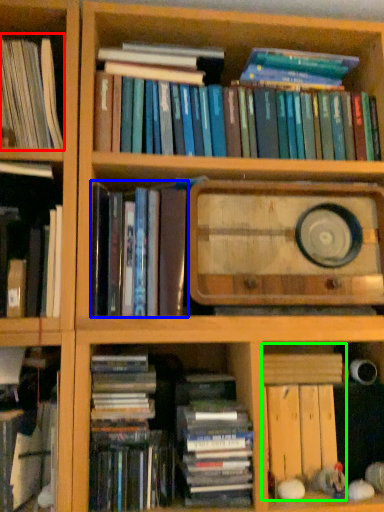
Question: Which object is the farthest from book (highlighted by a red box)? Choose among these: book (highlighted by a blue box) or book (highlighted by a green box).

Choices:
 (A) book
 (B) book

Answer: (B)